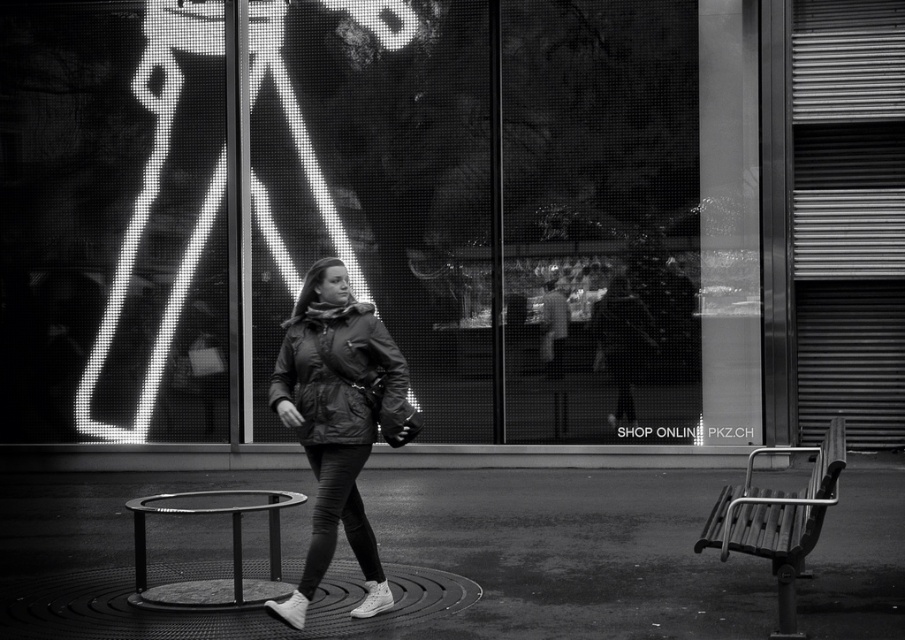
Is point (710, 342) positioned behind point (239, 508)?

Yes, point (710, 342) is behind point (239, 508).

The image size is (905, 640). What do you see at coordinates (382, 212) in the screenshot?
I see `matte glass shop window at center` at bounding box center [382, 212].

You are a GUI agent. You are given a task and a screenshot of the screen. Output one action in this format:
    pyautogui.click(x=<x>, y=<y>)
    Task: Click on the matte glass shop window at center
    The height and width of the screenshot is (640, 905).
    Given the screenshot: What is the action you would take?
    pos(382,212)

Measure the distance from matte glass shop window at center to circular metal grate at center.

matte glass shop window at center and circular metal grate at center are 13.99 feet apart.

Which is behind, point (505, 81) or point (170, 522)?

The point (505, 81) is more distant.

Locate an element on the screen. Image resolution: width=905 pixels, height=640 pixels. matte glass shop window at center is located at coordinates [382, 212].

Can you confirm if matte black jacket at center is taller than metallic stool at center?

Yes, matte black jacket at center is taller than metallic stool at center.

How much distance is there between matte black jacket at center and metallic stool at center?

A distance of 24.76 inches exists between matte black jacket at center and metallic stool at center.

At what (x,y) coordinates should I click in order to perform the action: click on matte black jacket at center. Please return your answer as a coordinate pair (x, y). Looking at the image, I should click on (338, 420).